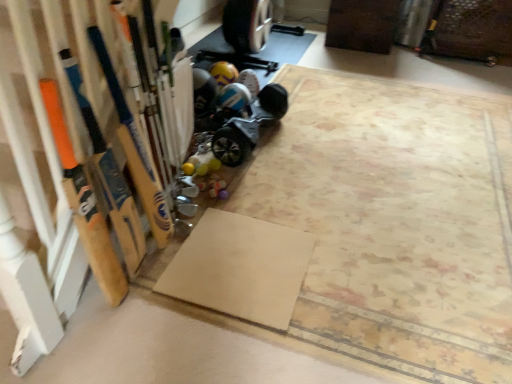
Question: Can we say beige matte yoga mat at lower center lies outside blue metallic hoverboard at lower center?

Choices:
 (A) yes
 (B) no

Answer: (A)

Question: Is beige matte yoga mat at lower center touching blue metallic hoverboard at lower center?

Choices:
 (A) no
 (B) yes

Answer: (A)

Question: Can you confirm if beige matte yoga mat at lower center is shorter than blue metallic hoverboard at lower center?

Choices:
 (A) yes
 (B) no

Answer: (A)

Question: From a real-world perspective, is beige matte yoga mat at lower center located beneath blue metallic hoverboard at lower center?

Choices:
 (A) no
 (B) yes

Answer: (B)

Question: Is blue metallic hoverboard at lower center completely or partially inside beige matte yoga mat at lower center?

Choices:
 (A) no
 (B) yes

Answer: (A)

Question: Is beige matte yoga mat at lower center to the left of blue metallic hoverboard at lower center from the viewer's perspective?

Choices:
 (A) yes
 (B) no

Answer: (A)

Question: Can you confirm if beige matte yoga mat at lower center is shorter than wooden baseball bat at left, placed as the 2th baseball bat when sorted from left to right?

Choices:
 (A) yes
 (B) no

Answer: (A)

Question: Is beige matte yoga mat at lower center at the right side of wooden baseball bat at left, placed as the 2th baseball bat when sorted from left to right?

Choices:
 (A) yes
 (B) no

Answer: (A)

Question: From the image's perspective, is beige matte yoga mat at lower center located beneath wooden baseball bat at left, which is the first baseball bat from right to left?

Choices:
 (A) no
 (B) yes

Answer: (B)

Question: From a real-world perspective, is beige matte yoga mat at lower center over wooden baseball bat at left, which is the first baseball bat from right to left?

Choices:
 (A) yes
 (B) no

Answer: (B)

Question: Is beige matte yoga mat at lower center not near wooden baseball bat at left, which is the first baseball bat from right to left?

Choices:
 (A) no
 (B) yes

Answer: (A)

Question: Considering the relative sizes of beige matte yoga mat at lower center and wooden baseball bat at left, placed as the 2th baseball bat when sorted from left to right, in the image provided, is beige matte yoga mat at lower center wider than wooden baseball bat at left, placed as the 2th baseball bat when sorted from left to right,?

Choices:
 (A) yes
 (B) no

Answer: (A)

Question: Is blue metallic hoverboard at lower center positioned with its back to wooden baseball bat at left, the first baseball bat when ordered from left to right?

Choices:
 (A) yes
 (B) no

Answer: (B)